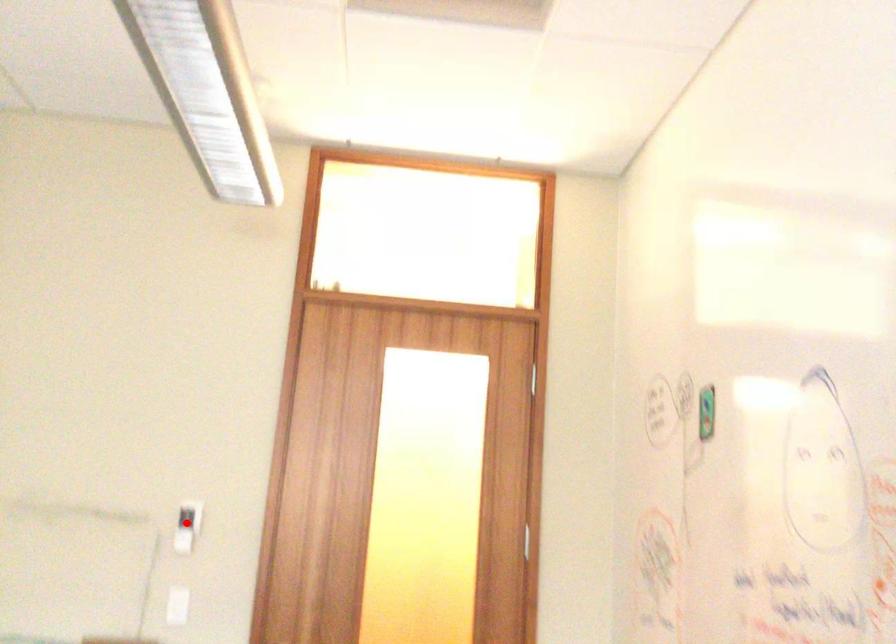
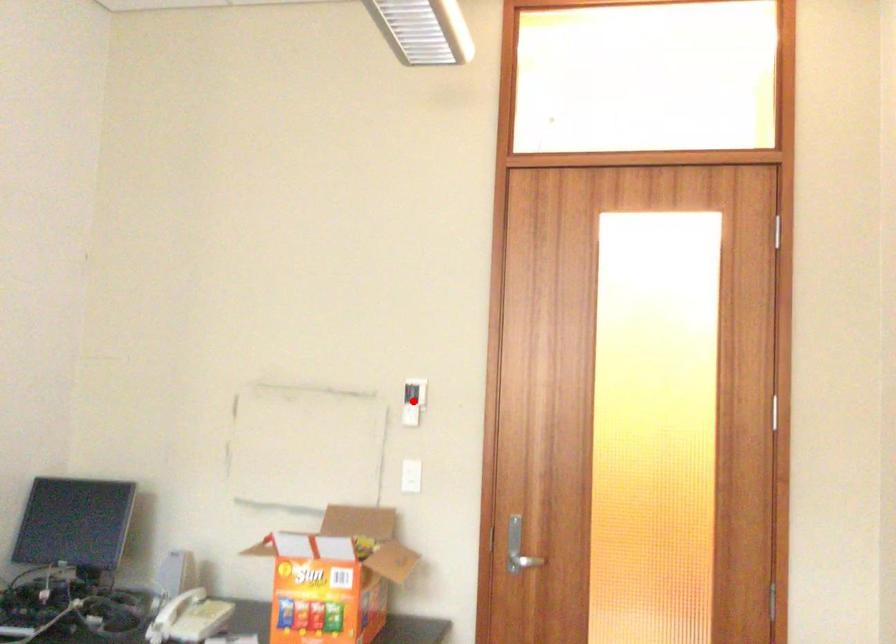
I am providing you with two images of the same scene from different viewpoints. A red point is marked on the first image and another point is marked on the second image. Does the point marked in image1 correspond to the same location as the one in image2?

Yes